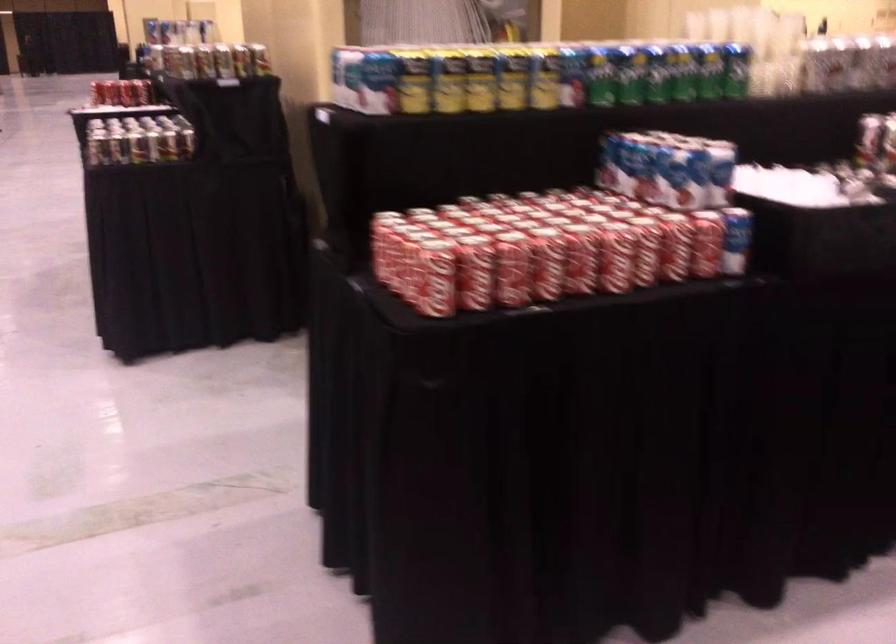
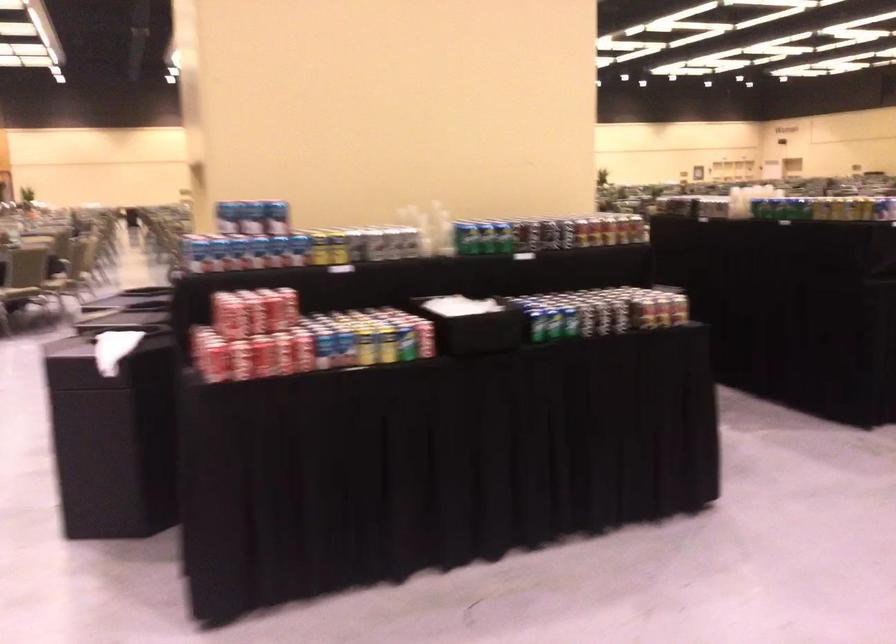
Where in the second image is the point corresponding to [121,91] from the first image?

(365, 346)